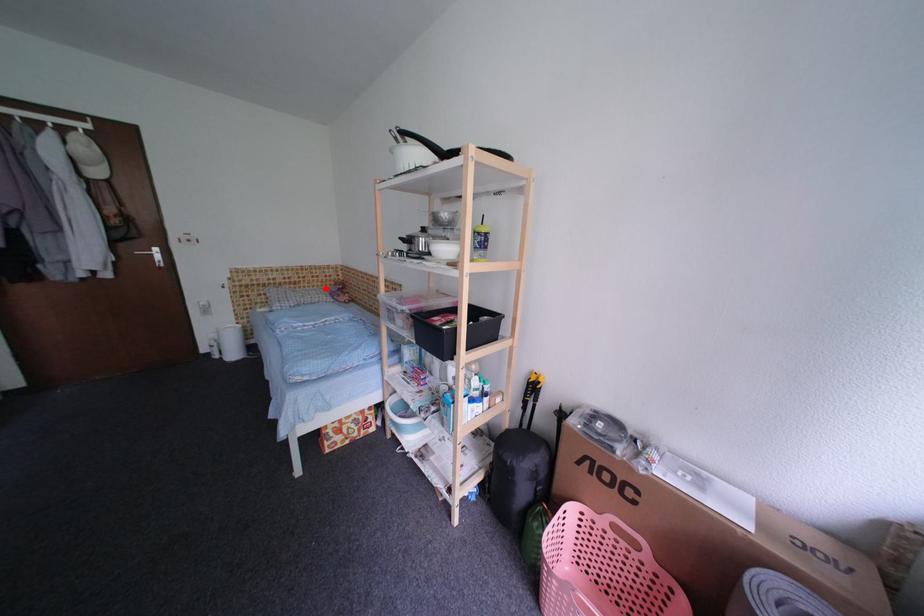
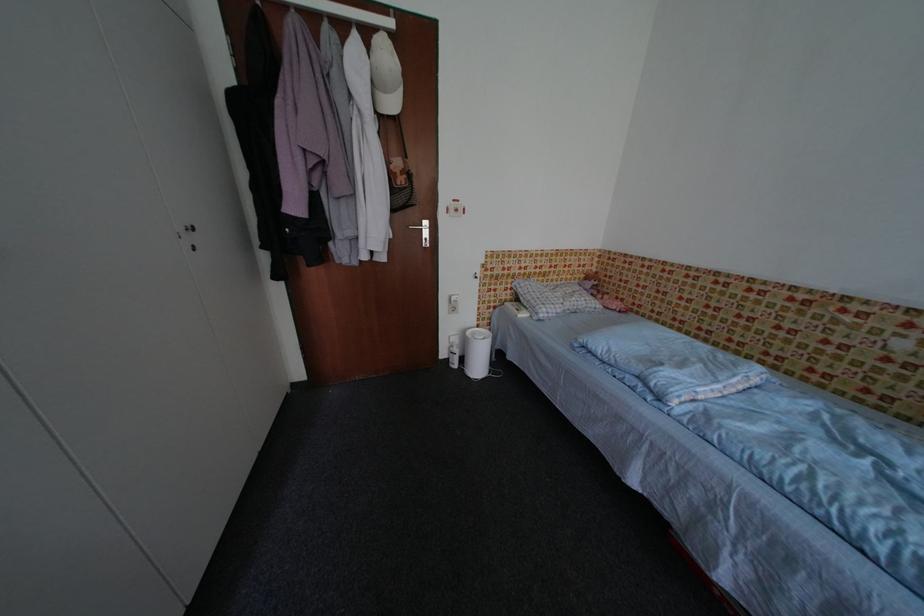
Question: A red point is marked in image1. In image2, is the corresponding 3D point closer to the camera or farther? Reply with the corresponding letter.

Choices:
 (A) The corresponding 3D point is closer.
 (B) The corresponding 3D point is farther.

Answer: (A)